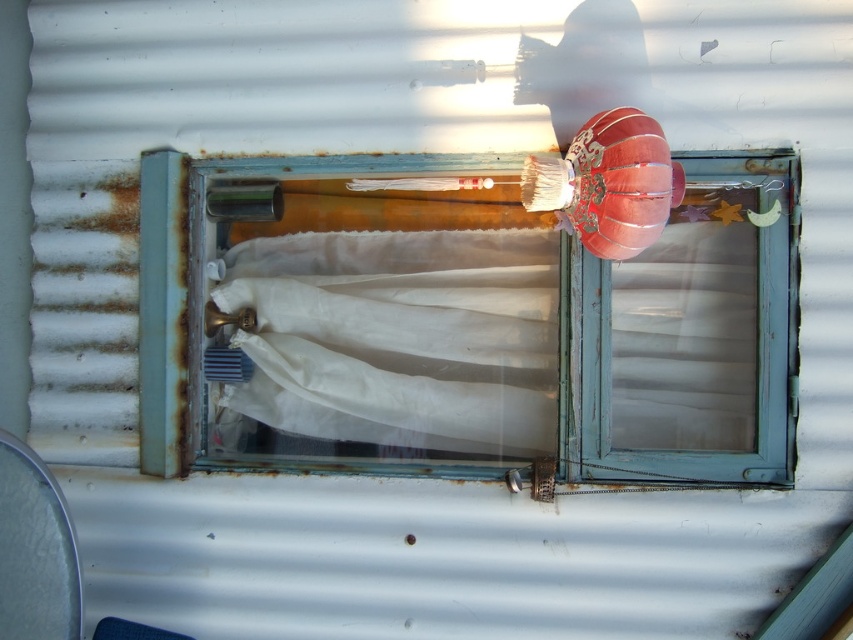
You are standing in a room with a window. You see a blue painted wood at center and a white sheer curtain at center. Which object is positioned higher in the image?

The blue painted wood at center is located above the white sheer curtain at center, so it is positioned higher.

You are standing in front of the window with the faded teal frame and weathered corrugated metal wall. You notice a specific point marked at coordinates (x=456, y=332). What object is located at this point?

The blue painted wood at center is located at point (x=456, y=332).

Based on the scene description, what is located at the coordinates point (456, 332)?

The coordinates point (456, 332) corresponds to blue painted wood at center.